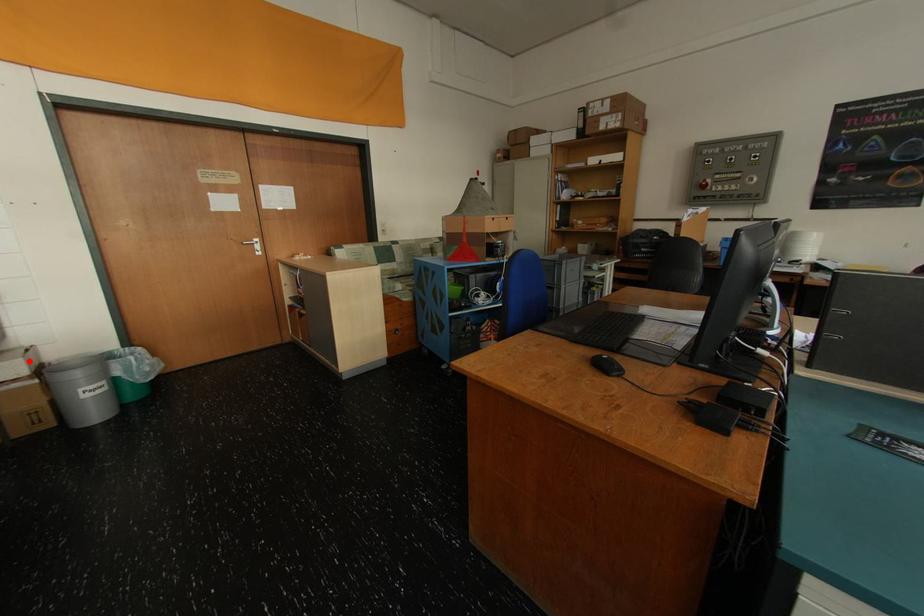
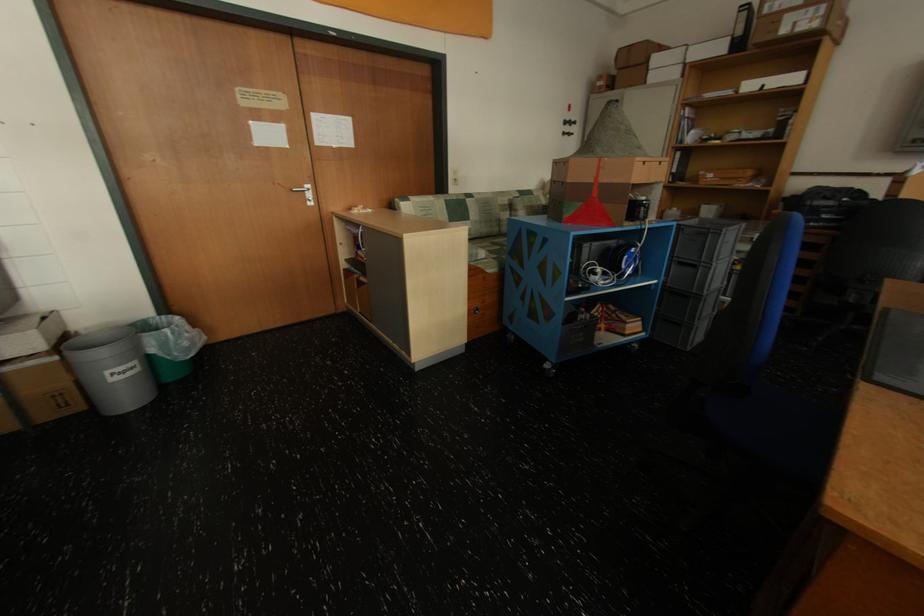
Question: I am providing you with two images of the same scene from different viewpoints. Image1 has a red point marked. In image2, the corresponding 3D location appears at what relative position? Reply with the corresponding letter.

Choices:
 (A) Closer
 (B) Farther

Answer: (A)